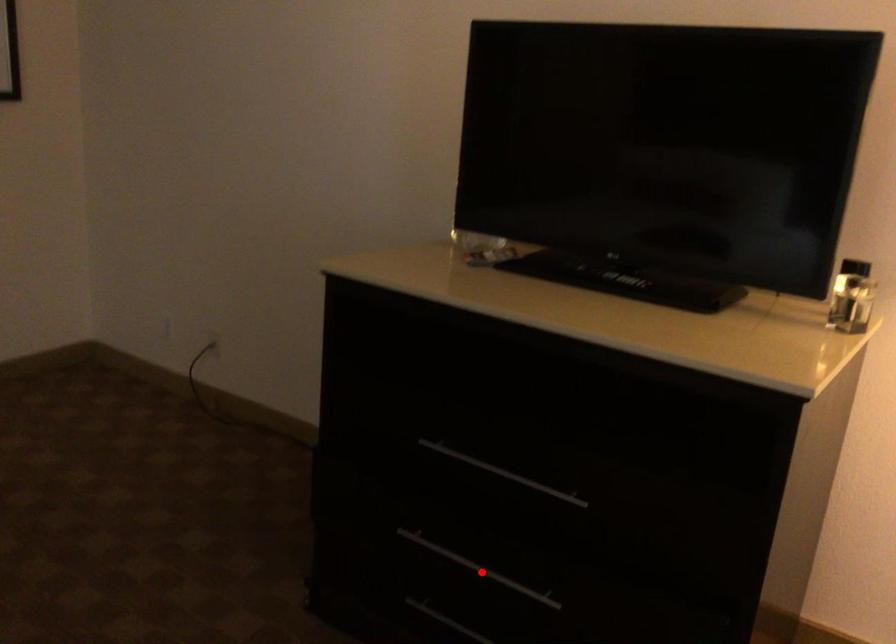
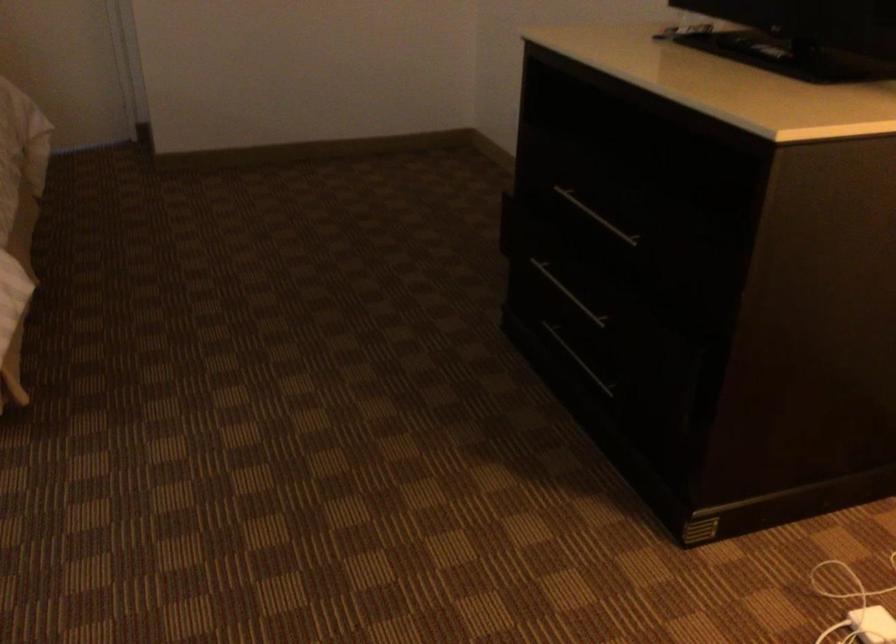
Question: I am providing you with two images of the same scene from different viewpoints. Given a red point in image1, look at the same physical point in image2. Is it:

Choices:
 (A) Closer to the viewpoint
 (B) Farther from the viewpoint

Answer: (B)